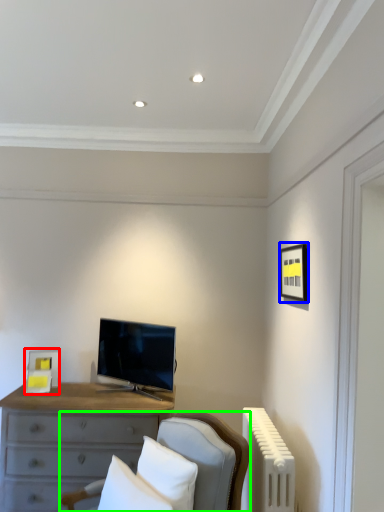
Question: Which object is the closest to the picture frame (highlighted by a red box)? Choose among these: picture frame (highlighted by a blue box) or furniture (highlighted by a green box).

Choices:
 (A) picture frame
 (B) furniture

Answer: (B)